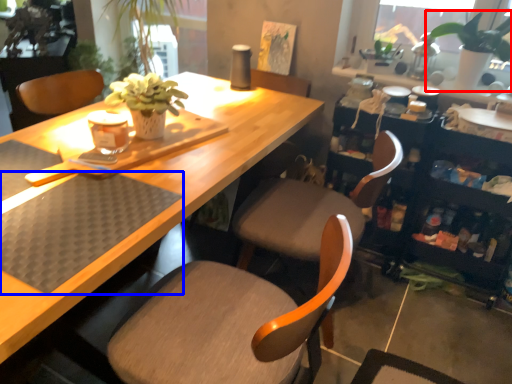
Question: Among these objects, which one is nearest to the camera, houseplant (highlighted by a red box) or wide (highlighted by a blue box)?

Choices:
 (A) houseplant
 (B) wide

Answer: (B)